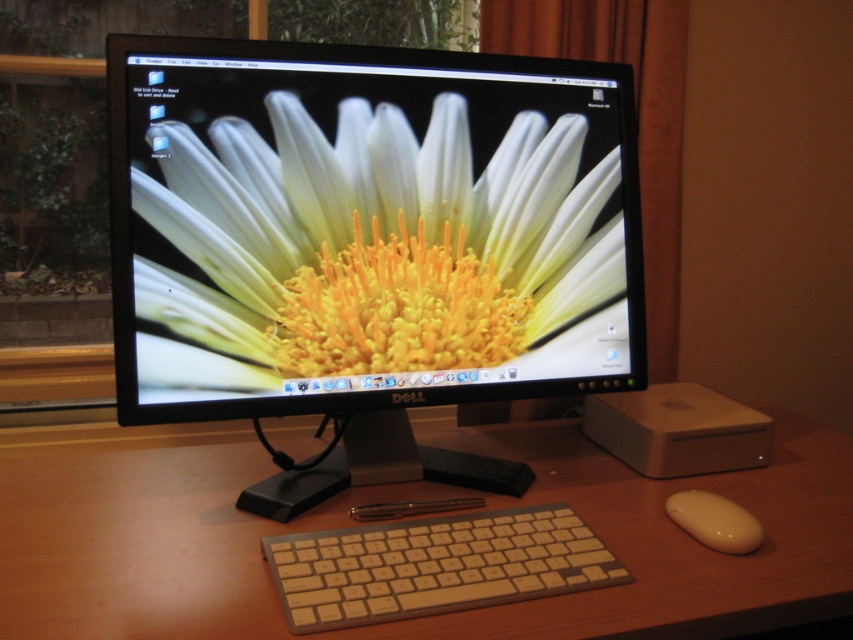
You are organizing your desk and want to stack the beige plastic keyboard at center and the white glossy mouse at lower right vertically. Which object should you place at the bottom to ensure stability?

You should place the beige plastic keyboard at center at the bottom because it has a greater height compared to the white glossy mouse at lower right, providing a more stable base.

You are organizing your desk and want to stack a book on top of the matte plastic monitor at center and the beige plastic keyboard at center. Which object can the book be placed on without exceeding its height?

The book can be placed on the matte plastic monitor at center because it has a greater height compared to the beige plastic keyboard at center, providing enough space for the book to rest on top.

You are organizing the desk and want to place a new wireless charger between the matte plastic monitor at center and the beige plastic keyboard at center. According to the desk layout, where should you position the wireless charger relative to these two items?

The beige plastic keyboard at center is behind the matte plastic monitor at center, so to place the wireless charger between them, position it in front of the matte plastic monitor at center and behind the beige plastic keyboard at center. However, since the keyboard is already behind the monitor, this might not be possible. Please check the actual desk layout for accurate placement.